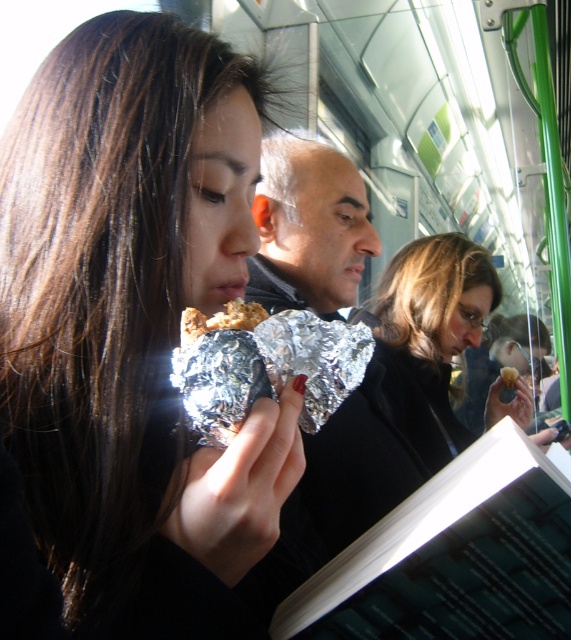
You are a passenger on a train and you see a matte black jacket at center and a silver foil wrapped food at center. Which object is more to the right?

The matte black jacket at center is positioned on the right side of silver foil wrapped food at center, so it is more to the right.